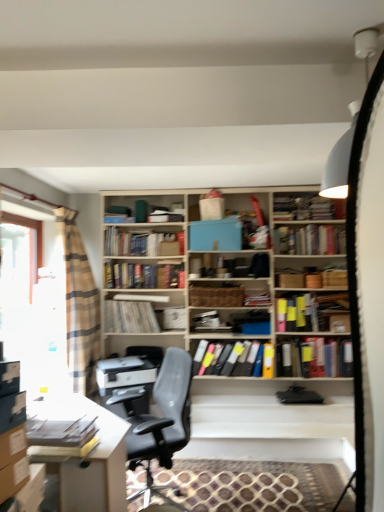
Question: From a real-world perspective, is brown woven basket at center positioned over multicolored file folders at center, the 7th book when ordered from back to front, based on gravity?

Choices:
 (A) yes
 (B) no

Answer: (A)

Question: Can you see brown woven basket at center touching multicolored file folders at center, which ranks as the 2th book in front-to-back order?

Choices:
 (A) no
 (B) yes

Answer: (A)

Question: Is brown woven basket at center positioned in front of multicolored file folders at center, the 7th book when ordered from back to front?

Choices:
 (A) yes
 (B) no

Answer: (B)

Question: From the image's perspective, is brown woven basket at center under multicolored file folders at center, the 7th book when ordered from back to front?

Choices:
 (A) yes
 (B) no

Answer: (B)

Question: Is brown woven basket at center to the left of multicolored file folders at center, the 7th book when ordered from back to front, from the viewer's perspective?

Choices:
 (A) no
 (B) yes

Answer: (B)

Question: Considering the relative sizes of brown woven basket at center and multicolored file folders at center, which ranks as the 2th book in front-to-back order, in the image provided, is brown woven basket at center bigger than multicolored file folders at center, which ranks as the 2th book in front-to-back order,?

Choices:
 (A) yes
 (B) no

Answer: (B)

Question: Can you confirm if white paper at center, the 1th book when ordered from back to front, is thinner than clear glass window at left?

Choices:
 (A) yes
 (B) no

Answer: (A)

Question: Is white paper at center, the 1th book when ordered from back to front, oriented towards clear glass window at left?

Choices:
 (A) yes
 (B) no

Answer: (B)

Question: Considering the relative sizes of white paper at center, the eighth book positioned from the front, and clear glass window at left in the image provided, is white paper at center, the eighth book positioned from the front, wider than clear glass window at left?

Choices:
 (A) yes
 (B) no

Answer: (B)

Question: Is white paper at center, the eighth book positioned from the front, smaller than clear glass window at left?

Choices:
 (A) yes
 (B) no

Answer: (A)

Question: Is white paper at center, the 1th book when ordered from back to front, completely or partially outside of clear glass window at left?

Choices:
 (A) no
 (B) yes

Answer: (B)

Question: Does white paper at center, the 1th book when ordered from back to front, have a lesser height compared to clear glass window at left?

Choices:
 (A) yes
 (B) no

Answer: (A)

Question: Does white paper at center, the eighth book positioned from the front, turn towards black leather chair at center?

Choices:
 (A) no
 (B) yes

Answer: (B)